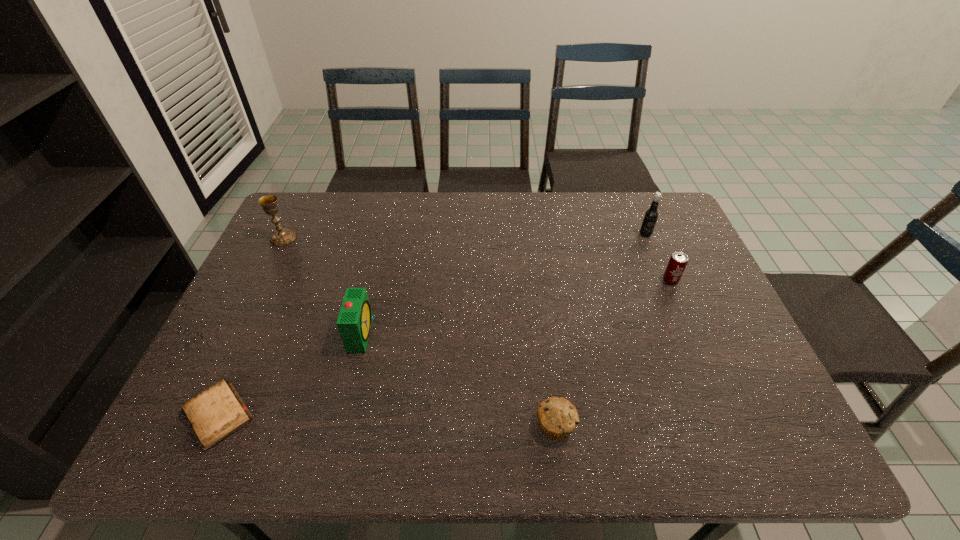
Find the location of a particular element. This screenshot has width=960, height=540. vacant space that's between the beer can and the root beer is located at coordinates (658, 258).

In order to click on vacant region between the diary and the fifth tallest object in this screenshot , I will do `click(387, 420)`.

Identify which object is the fifth nearest to the alarm clock. Please provide its 2D coordinates. Your answer should be formatted as a tuple, i.e. [(x, y)], where the tuple contains the x and y coordinates of a point satisfying the conditions above.

[(651, 215)]

Identify the location of object that stands as the fifth closest to the third tallest object. (x=651, y=215).

At what (x,y) coordinates should I click in order to perform the action: click on vacant space that satisfies the following two spatial constraints: 1. on the front-facing side of the third nearest object; 2. on the left side of the fifth tallest object. Please return your answer as a coordinate pair (x, y). This screenshot has width=960, height=540. Looking at the image, I should click on (339, 425).

The height and width of the screenshot is (540, 960). Find the location of `vacant region that satisfies the following two spatial constraints: 1. on the front side of the chalice; 2. on the right side of the muffin`. vacant region that satisfies the following two spatial constraints: 1. on the front side of the chalice; 2. on the right side of the muffin is located at coordinates tap(192, 425).

Locate an element on the screen. The image size is (960, 540). free spot that satisfies the following two spatial constraints: 1. on the front-facing side of the fourth object from right to left; 2. on the left side of the muffin is located at coordinates (339, 425).

Locate an element on the screen. This screenshot has height=540, width=960. free spot that satisfies the following two spatial constraints: 1. on the back side of the third object from right to left; 2. on the right side of the fourth tallest object is located at coordinates (537, 280).